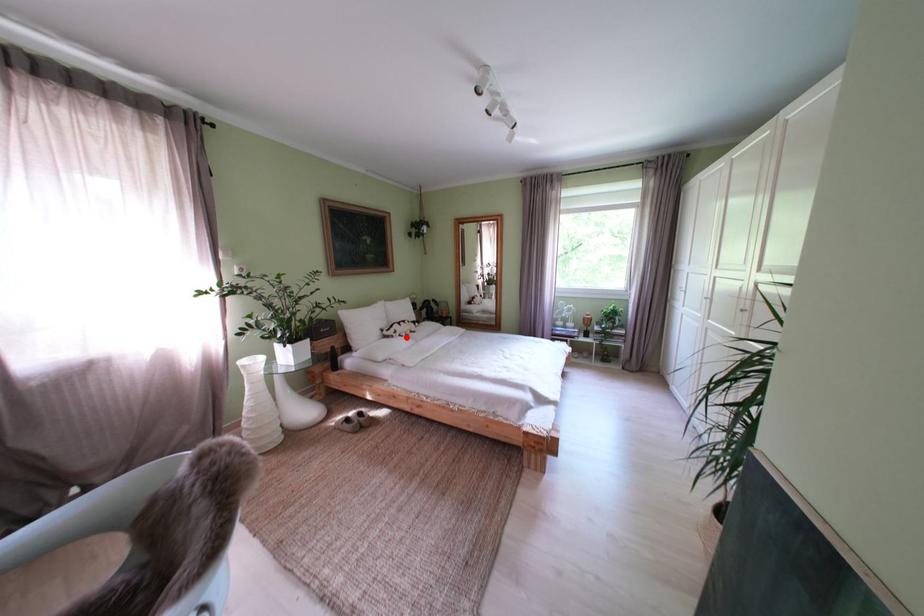
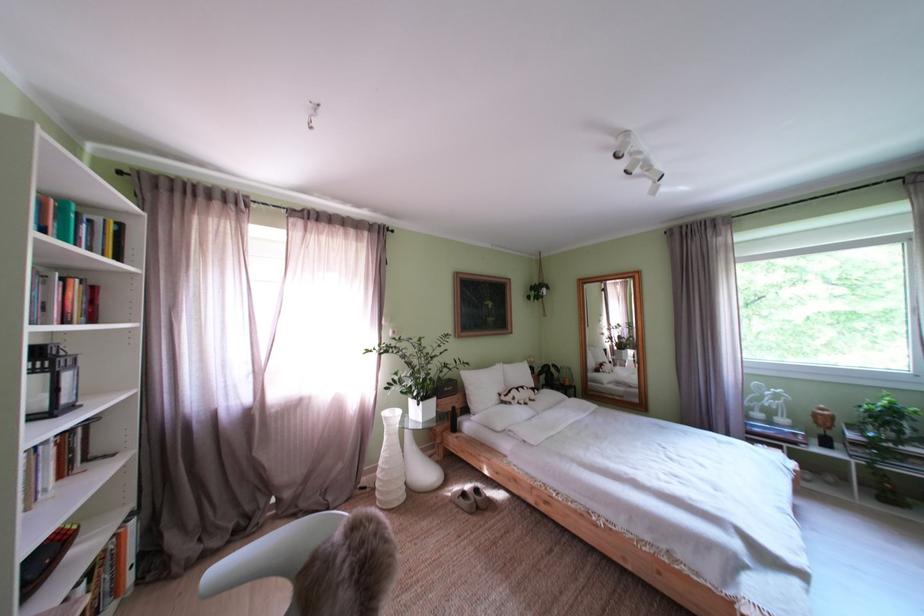
Find the pixel in the second image that matches the highlighted location in the first image.

(525, 405)